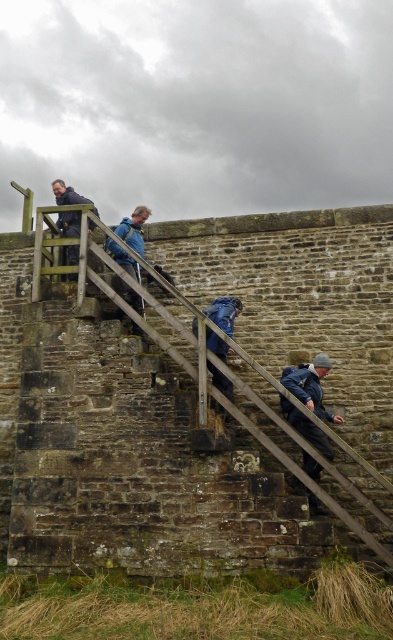
Question: Which is farther from the wooden at upper left?

Choices:
 (A) dark blue jacket at lower right
 (B) matte black jacket at upper left
 (C) blue fabric jacket at upper center
 (D) blue fabric jacket at center

Answer: (B)

Question: Which point is closer to the camera?

Choices:
 (A) matte black jacket at upper left
 (B) blue fabric jacket at center
 (C) blue fabric jacket at upper center
 (D) wooden at upper left

Answer: (D)

Question: Which point is closer to the camera?

Choices:
 (A) (130, 358)
 (B) (216, 371)

Answer: (A)

Question: Is wooden at upper left positioned at the back of matte black jacket at upper left?

Choices:
 (A) no
 (B) yes

Answer: (A)

Question: Does blue fabric jacket at center have a smaller size compared to blue fabric jacket at upper center?

Choices:
 (A) yes
 (B) no

Answer: (A)

Question: Can you confirm if wooden at upper left is positioned to the left of blue fabric jacket at upper center?

Choices:
 (A) no
 (B) yes

Answer: (A)